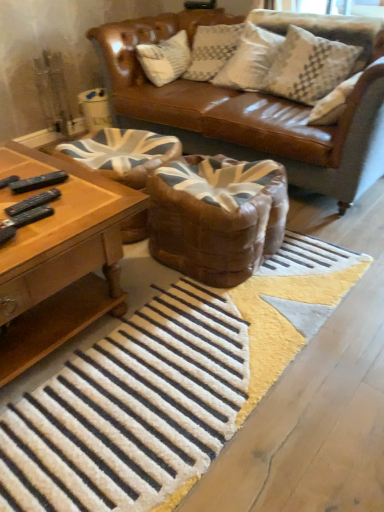
The width and height of the screenshot is (384, 512). Identify the location of free spot above white textured rug at center (from a real-world perspective). (178, 347).